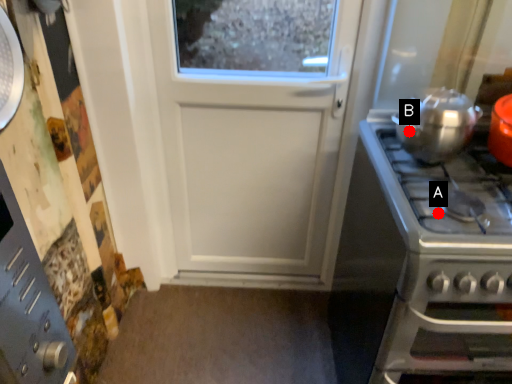
Question: Two points are circled on the image, labeled by A and B beside each circle. Which point is closer to the camera taking this photo?

Choices:
 (A) A is closer
 (B) B is closer

Answer: (A)